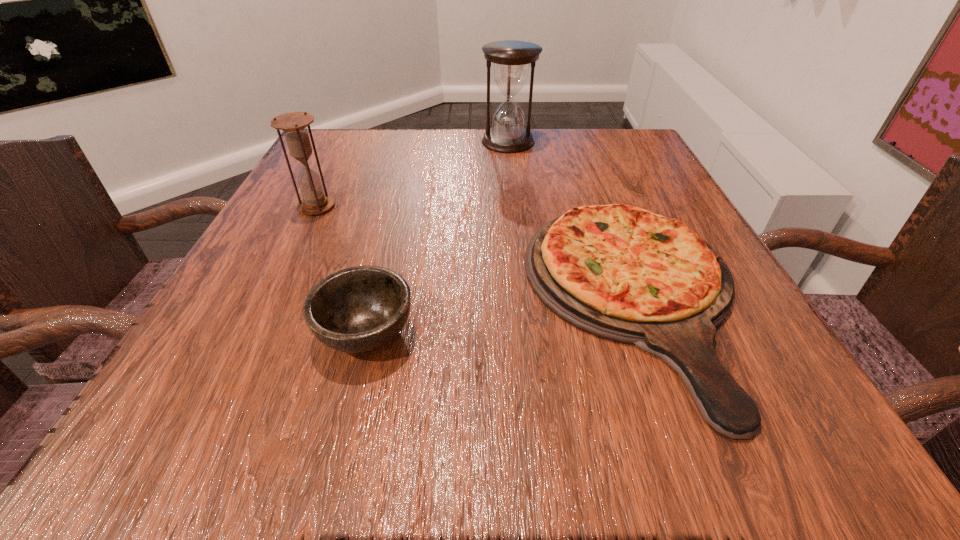
Where is `vacant point located on the left of the shortest object`? The image size is (960, 540). vacant point located on the left of the shortest object is located at coordinates (482, 299).

Identify the location of object that is at the far edge. (511, 58).

Identify the location of object that is at the near edge. (622, 273).

The height and width of the screenshot is (540, 960). I want to click on object present at the left edge, so click(294, 124).

This screenshot has height=540, width=960. I want to click on object that is positioned at the right edge, so click(622, 273).

Where is `object positioned at the near right corner`? The height and width of the screenshot is (540, 960). object positioned at the near right corner is located at coordinates (622, 273).

The width and height of the screenshot is (960, 540). Find the location of `free space at the far edge of the desktop`. free space at the far edge of the desktop is located at coordinates (464, 145).

In the image, there is a desktop. At what (x,y) coordinates should I click in order to perform the action: click on vacant space at the near edge. Please return your answer as a coordinate pair (x, y). The image size is (960, 540). Looking at the image, I should click on point(404,438).

You are a GUI agent. You are given a task and a screenshot of the screen. Output one action in this format:
    pyautogui.click(x=<x>, y=<y>)
    Task: Click on the free point at the left edge
    The image size is (960, 540).
    Given the screenshot: What is the action you would take?
    pyautogui.click(x=265, y=328)

The width and height of the screenshot is (960, 540). In order to click on vacant region at the right edge of the desktop in this screenshot , I will do `click(665, 202)`.